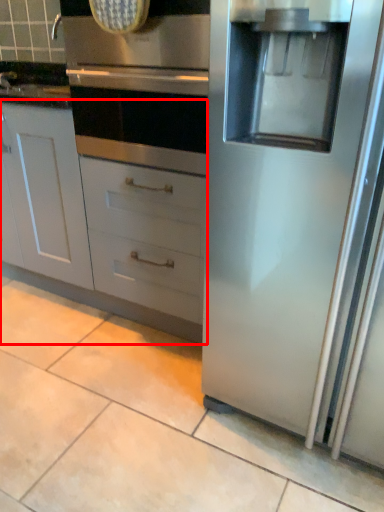
Question: From the image's perspective, where is cabinetry (annotated by the red box) located relative to oven?

Choices:
 (A) above
 (B) below

Answer: (B)